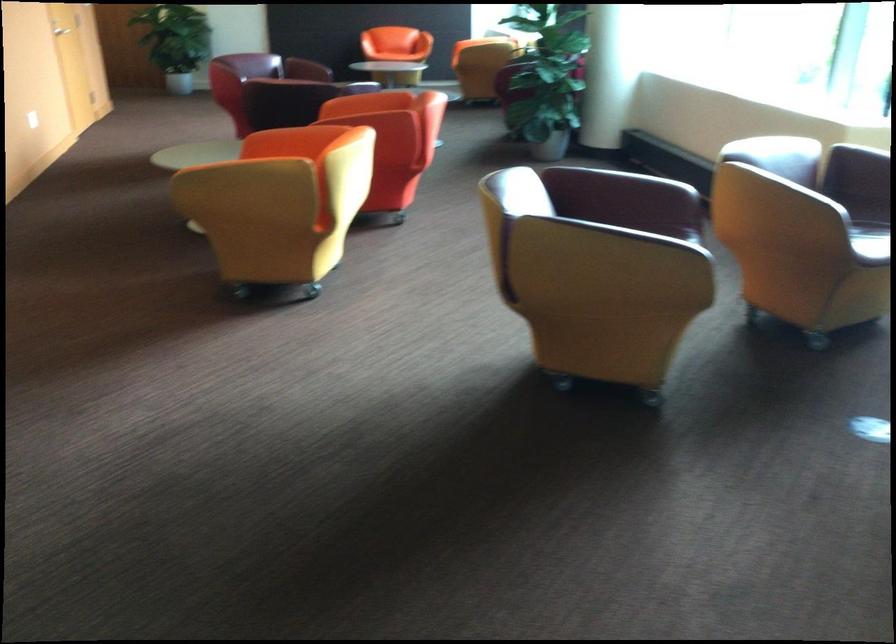
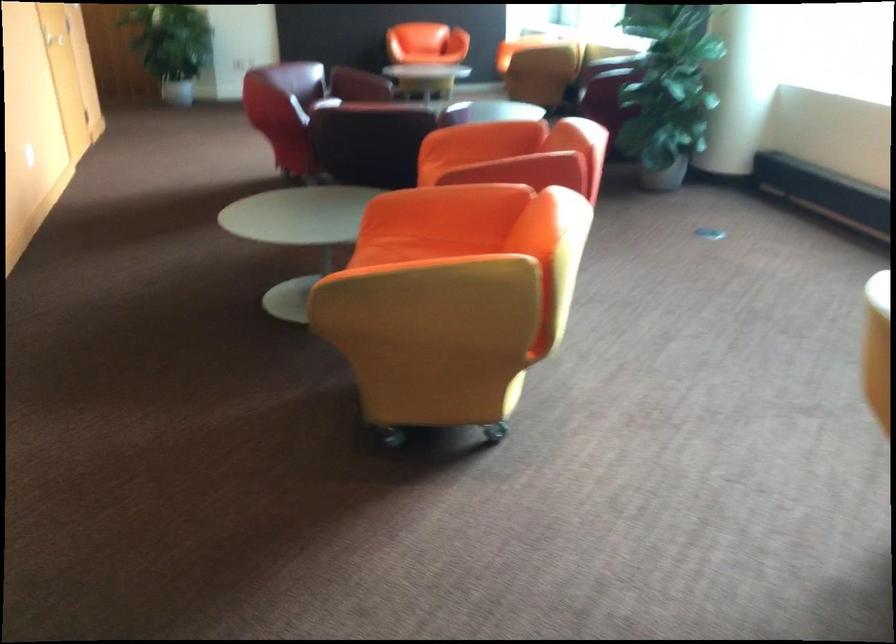
The images are taken continuously from a first-person perspective. In which direction are you moving?

The movement direction of the cameraman is left, forward.